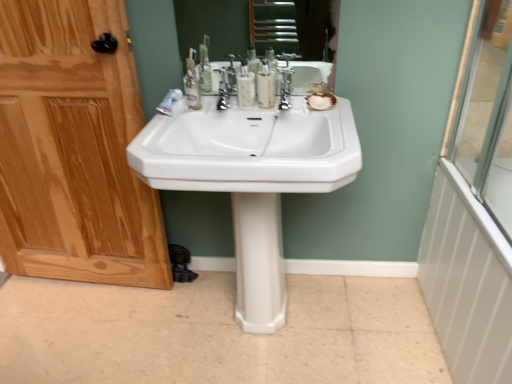
Where is `free point in front of white glossy pedestal at center`? The height and width of the screenshot is (384, 512). free point in front of white glossy pedestal at center is located at coordinates (266, 354).